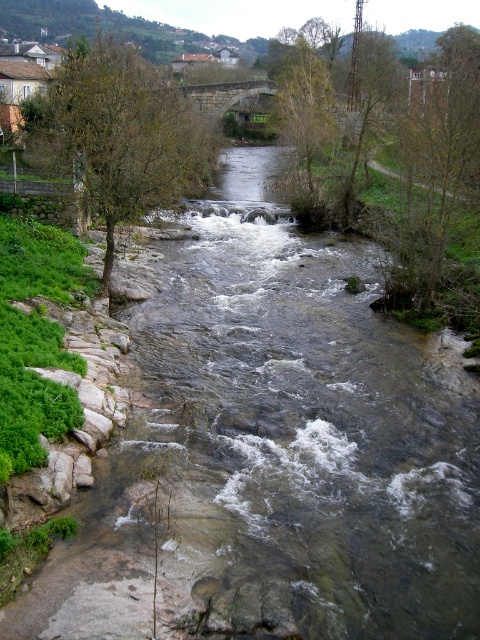
Question: Which object is closer to the camera taking this photo?

Choices:
 (A) green leafy tree at left
 (B) green leafy tree at upper center
 (C) green leafy tree at upper right

Answer: (A)

Question: Does green leafy tree at upper right come behind green leafy tree at upper center?

Choices:
 (A) yes
 (B) no

Answer: (B)

Question: Is green leafy tree at left thinner than green leafy tree at upper center?

Choices:
 (A) yes
 (B) no

Answer: (B)

Question: Considering the real-world distances, which object is farthest from the green leafy tree at left?

Choices:
 (A) green leafy tree at upper right
 (B) green leafy tree at upper center

Answer: (A)

Question: Does green leafy tree at left appear under green leafy tree at upper right?

Choices:
 (A) no
 (B) yes

Answer: (B)

Question: Among these points, which one is nearest to the camera?

Choices:
 (A) (139, 65)
 (B) (404, 157)
 (C) (295, 195)

Answer: (C)